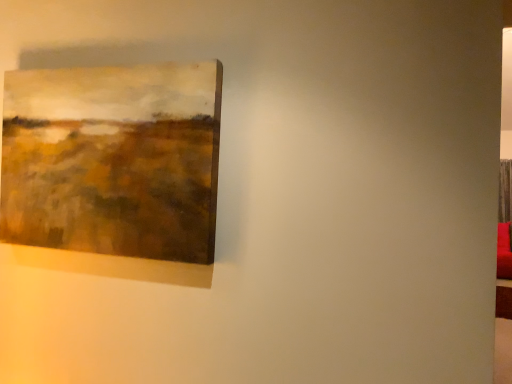
What do you see at coordinates (113, 169) in the screenshot? The height and width of the screenshot is (384, 512). I see `matte canvas painting at upper left` at bounding box center [113, 169].

This screenshot has height=384, width=512. I want to click on matte canvas painting at upper left, so click(113, 169).

This screenshot has width=512, height=384. Identify the location of matte canvas painting at upper left. (113, 169).